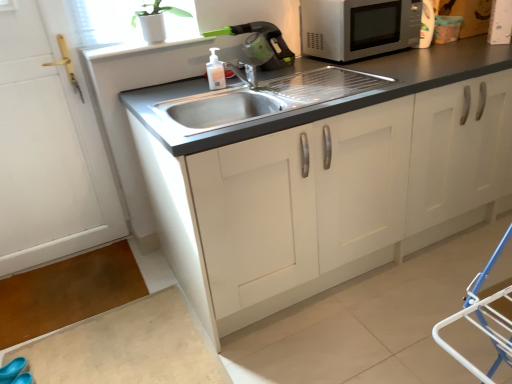
I want to click on white matte cabinet at center, so click(x=319, y=172).

Image resolution: width=512 pixels, height=384 pixels. Describe the element at coordinates (13, 369) in the screenshot. I see `blue rubber shoe at lower left` at that location.

This screenshot has width=512, height=384. I want to click on blue rubber shoe at lower left, so click(13, 369).

Locate an element on the screen. white matte door at left is located at coordinates (49, 146).

In the scene shown: What is the approximate height of white matte door at left?

white matte door at left is 4.41 feet tall.

The image size is (512, 384). What do you see at coordinates (500, 22) in the screenshot?
I see `white plastic container at upper right, acting as the second appliance starting from the left` at bounding box center [500, 22].

This screenshot has width=512, height=384. In order to click on satin silver microwave at upper right in this screenshot , I will do `click(358, 27)`.

Considering the positions of objects green plastic kettle at upper center, positioned as the 2th appliance in right-to-left order, and stainless steel sink at center in the image provided, who is more to the left, green plastic kettle at upper center, positioned as the 2th appliance in right-to-left order, or stainless steel sink at center?

Positioned to the left is green plastic kettle at upper center, positioned as the 2th appliance in right-to-left order.

Is green plastic kettle at upper center, the first appliance viewed from the left, with stainless steel sink at center?

No, green plastic kettle at upper center, the first appliance viewed from the left, is not making contact with stainless steel sink at center.

Looking at this image, is green plastic kettle at upper center, the first appliance viewed from the left, inside or outside of stainless steel sink at center?

green plastic kettle at upper center, the first appliance viewed from the left, is spatially situated outside stainless steel sink at center.

How different are the orientations of green plastic kettle at upper center, positioned as the 2th appliance in right-to-left order, and stainless steel sink at center in degrees?

The facing directions of green plastic kettle at upper center, positioned as the 2th appliance in right-to-left order, and stainless steel sink at center are 1.6 degrees apart.

Is point (203, 297) in front of point (253, 59)?

Yes, it is in front of point (253, 59).

Is white matte cabinet at center taller or shorter than green plastic kettle at upper center, positioned as the 2th appliance in right-to-left order?

Considering their sizes, white matte cabinet at center has more height than green plastic kettle at upper center, positioned as the 2th appliance in right-to-left order.

Considering the positions of objects white matte cabinet at center and green plastic kettle at upper center, the first appliance viewed from the left, in the image provided, who is in front, white matte cabinet at center or green plastic kettle at upper center, the first appliance viewed from the left,?

white matte cabinet at center is in front.

Considering the sizes of white matte cabinet at center and green plastic kettle at upper center, positioned as the 2th appliance in right-to-left order, in the image, is white matte cabinet at center wider or thinner than green plastic kettle at upper center, positioned as the 2th appliance in right-to-left order,?

white matte cabinet at center is wider than green plastic kettle at upper center, positioned as the 2th appliance in right-to-left order.

Can you see white matte cabinet at center touching white matte door at left?

There is a gap between white matte cabinet at center and white matte door at left.

From the image's perspective, between white matte cabinet at center and white matte door at left, who is located below?

white matte door at left is shown below in the image.

Can you confirm if white matte cabinet at center is positioned to the left of white matte door at left?

Incorrect, white matte cabinet at center is not on the left side of white matte door at left.

Considering the sizes of white plastic container at upper right, acting as the second appliance starting from the left, and white matte plant pot at upper left in the image, is white plastic container at upper right, acting as the second appliance starting from the left, bigger or smaller than white matte plant pot at upper left?

In the image, white plastic container at upper right, acting as the second appliance starting from the left, appears to be smaller than white matte plant pot at upper left.

The image size is (512, 384). Find the location of `appliance above the white matte plant pot at upper left (from the image's perspective)`. appliance above the white matte plant pot at upper left (from the image's perspective) is located at coordinates (500, 22).

From the image's perspective, would you say white plastic container at upper right, acting as the second appliance starting from the left, is positioned over white matte plant pot at upper left?

Yes, from the image's perspective, white plastic container at upper right, acting as the second appliance starting from the left, is over white matte plant pot at upper left.

Is white plastic container at upper right, acting as the second appliance starting from the left, taller or shorter than white matte plant pot at upper left?

Considering their sizes, white plastic container at upper right, acting as the second appliance starting from the left, has more height than white matte plant pot at upper left.

Is translucent plastic soap dispenser at sink far from white matte door at left?

That's not correct — translucent plastic soap dispenser at sink is a little close to white matte door at left.

Visually, is translucent plastic soap dispenser at sink positioned to the left or to the right of white matte door at left?

Based on their positions, translucent plastic soap dispenser at sink is located to the right of white matte door at left.

Does translucent plastic soap dispenser at sink have a greater width compared to white matte door at left?

No, translucent plastic soap dispenser at sink is not wider than white matte door at left.

Can you confirm if translucent plastic soap dispenser at sink is smaller than white matte door at left?

Yes.

Is white matte cabinet at center directly adjacent to white matte plant pot at upper left?

No, white matte cabinet at center is not touching white matte plant pot at upper left.

Is white matte cabinet at center shorter than white matte plant pot at upper left?

In fact, white matte cabinet at center may be taller than white matte plant pot at upper left.

In order to click on window screen above the white matte cabinet at center (from a real-world perspective) in this screenshot , I will do `click(109, 21)`.

Find the location of a particular element. The image size is (512, 384). microwave oven on the left of white matte cabinet at center is located at coordinates (358, 27).

Does satin silver microwave at upper right come behind white matte cabinet at center?

Yes, it is.

Can you confirm if satin silver microwave at upper right is smaller than white matte cabinet at center?

Yes, satin silver microwave at upper right is smaller than white matte cabinet at center.

From the image's perspective, is satin silver microwave at upper right positioned above or below white matte cabinet at center?

Clearly, from the image's perspective, satin silver microwave at upper right is above white matte cabinet at center.

In order to click on sink beneath the green plastic kettle at upper center, positioned as the 2th appliance in right-to-left order (from a real-world perspective) in this screenshot , I will do `click(265, 99)`.

In the image, there is a green plastic kettle at upper center, the first appliance viewed from the left. Identify the location of cabinetry below it (from the image's perspective). (319, 172).

Considering their positions, is blue rubber shoe at lower left positioned further to white plastic container at upper right, acting as the first appliance starting from the right, than translucent plastic soap dispenser at sink?

blue rubber shoe at lower left lies further to white plastic container at upper right, acting as the first appliance starting from the right, than the other object.

Consider the image. Looking at the image, which one is located further to white matte door at left, stainless steel sink at center or blue rubber shoe at lower left?

Based on the image, blue rubber shoe at lower left appears to be further to white matte door at left.

From the image, which object appears to be nearer to stainless steel sink at center, white matte door at left or blue rubber shoe at lower left?

white matte door at left is positioned closer to the anchor stainless steel sink at center.

Looking at the image, which one is located further to white plastic container at upper right, acting as the first appliance starting from the right, white matte door at left or satin silver microwave at upper right?

white matte door at left lies further to white plastic container at upper right, acting as the first appliance starting from the right, than the other object.

Which object lies further to the anchor point white plastic container at upper right, acting as the first appliance starting from the right, white matte door at left or green plastic kettle at upper center, the first appliance viewed from the left?

Among the two, white matte door at left is located further to white plastic container at upper right, acting as the first appliance starting from the right.

Considering their positions, is green plastic kettle at upper center, positioned as the 2th appliance in right-to-left order, positioned closer to translucent plastic soap dispenser at sink than stainless steel sink at center?

green plastic kettle at upper center, positioned as the 2th appliance in right-to-left order, is positioned closer to the anchor translucent plastic soap dispenser at sink.

When comparing their distances from white plastic container at upper right, acting as the second appliance starting from the left, does translucent plastic soap dispenser at sink or green plastic kettle at upper center, the first appliance viewed from the left, seem further?

translucent plastic soap dispenser at sink.

Considering their positions, is white matte plant pot at upper left positioned further to translucent plastic soap dispenser at sink than white matte cabinet at center?

white matte cabinet at center is positioned further to the anchor translucent plastic soap dispenser at sink.

Identify the location of screen door between white matte plant pot at upper left and blue rubber shoe at lower left from top to bottom. Image resolution: width=512 pixels, height=384 pixels. (49, 146).

Find the location of `sink between white matte plant pot at upper left and blue rubber shoe at lower left in the up-down direction`. sink between white matte plant pot at upper left and blue rubber shoe at lower left in the up-down direction is located at coordinates (265, 99).

Locate an element on the screen. appliance between white matte plant pot at upper left and white matte cabinet at center from left to right is located at coordinates (260, 44).

The width and height of the screenshot is (512, 384). I want to click on microwave oven between green plastic kettle at upper center, the first appliance viewed from the left, and white matte cabinet at center, so click(358, 27).